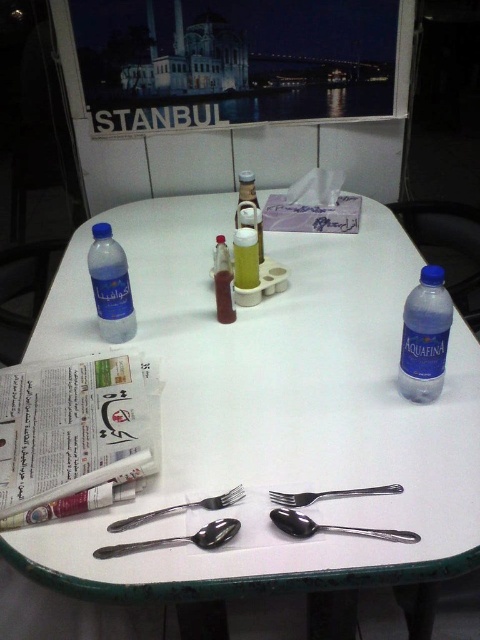
Question: Can you confirm if blue plastic water bottle at right is bigger than silver metallic spoon at center?

Choices:
 (A) yes
 (B) no

Answer: (A)

Question: Among these objects, which one is farthest from the camera?

Choices:
 (A) white plastic table at center
 (B) translucent plastic bottle at center
 (C) silver metallic spoon at center

Answer: (B)

Question: From the image, what is the correct spatial relationship of blue matte water bottle at left in relation to silver metallic spoon at lower center?

Choices:
 (A) above
 (B) below

Answer: (A)

Question: Which point is farther to the camera?

Choices:
 (A) blue matte water bottle at left
 (B) shiny metallic fork at lower left

Answer: (A)

Question: Estimate the real-world distances between objects in this image. Which object is farther from the blue plastic water bottle at right?

Choices:
 (A) white plastic table at center
 (B) translucent plastic bottle at center
 (C) silver metallic spoon at lower center
 (D) matte plastic bottle at center

Answer: (D)

Question: Does blue matte water bottle at left have a larger size compared to silver metallic spoon at lower center?

Choices:
 (A) no
 (B) yes

Answer: (B)